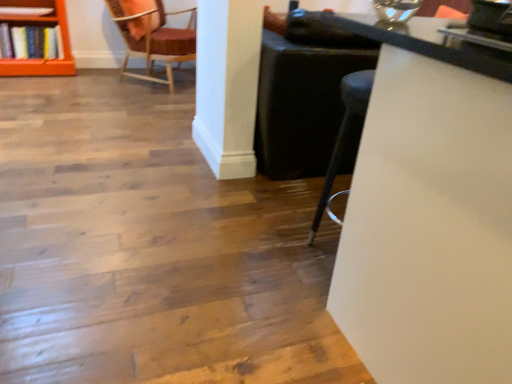
Question: Is point (481, 81) closer or farther from the camera than point (60, 31)?

Choices:
 (A) closer
 (B) farther

Answer: (A)

Question: Considering the positions of white glossy table at upper right and orange wood shelf at upper left in the image, is white glossy table at upper right taller or shorter than orange wood shelf at upper left?

Choices:
 (A) short
 (B) tall

Answer: (B)

Question: Estimate the real-world distances between objects in this image. Which object is farther from the velvet-like burgundy chair at upper left?

Choices:
 (A) white glossy table at upper right
 (B) orange wood shelf at upper left
 (C) hardcover books at left

Answer: (A)

Question: Estimate the real-world distances between objects in this image. Which object is farther from the hardcover books at left?

Choices:
 (A) velvet-like burgundy chair at upper left
 (B) white glossy table at upper right
 (C) orange wood shelf at upper left

Answer: (B)